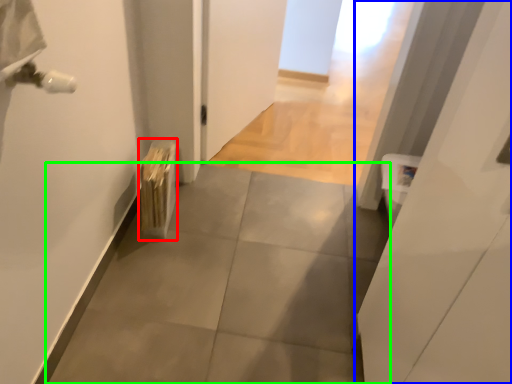
Question: Estimate the real-world distances between objects in this image. Which object is closer to radiator (highlighted by a red box), door (highlighted by a blue box) or concrete (highlighted by a green box)?

Choices:
 (A) door
 (B) concrete

Answer: (B)